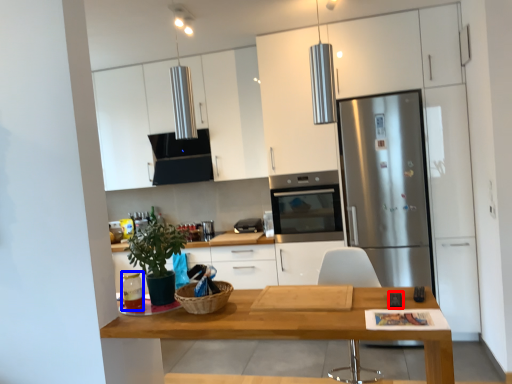
Question: Which object appears farthest to the camera in this image, appliance (highlighted by a red box) or appliance (highlighted by a blue box)?

Choices:
 (A) appliance
 (B) appliance

Answer: (B)